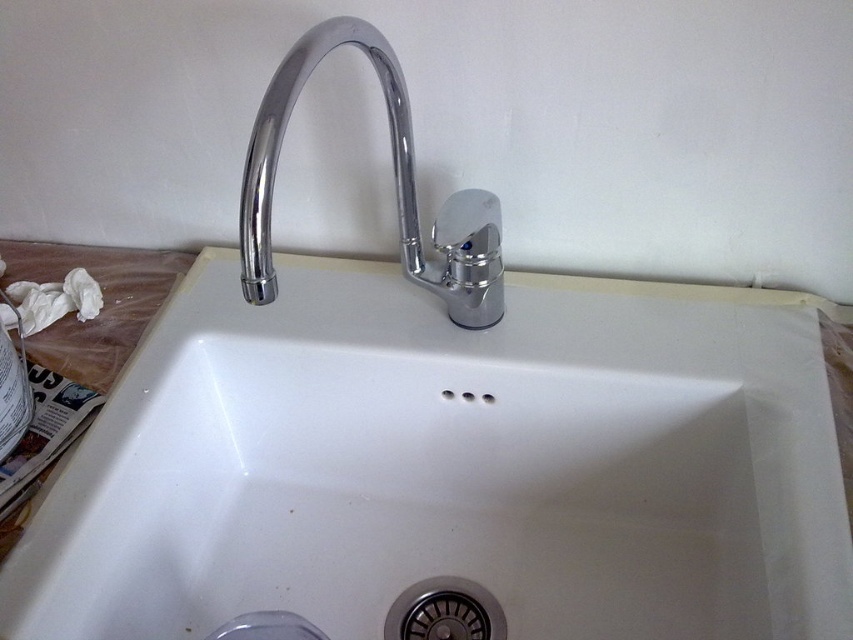
Question: Where is white ceramic sink at center located in relation to polished chrome faucet at center in the image?

Choices:
 (A) above
 (B) below

Answer: (B)

Question: Which object is closer to the camera taking this photo?

Choices:
 (A) polished chrome faucet at center
 (B) white ceramic sink at center

Answer: (A)

Question: Is white ceramic sink at center to the left of polished chrome faucet at center from the viewer's perspective?

Choices:
 (A) no
 (B) yes

Answer: (A)

Question: Does white ceramic sink at center have a larger size compared to polished chrome faucet at center?

Choices:
 (A) yes
 (B) no

Answer: (A)

Question: Which object is closer to the camera taking this photo?

Choices:
 (A) polished chrome faucet at center
 (B) white ceramic sink at center

Answer: (A)

Question: Which point appears farthest from the camera in this image?

Choices:
 (A) (312, 410)
 (B) (247, 248)

Answer: (A)